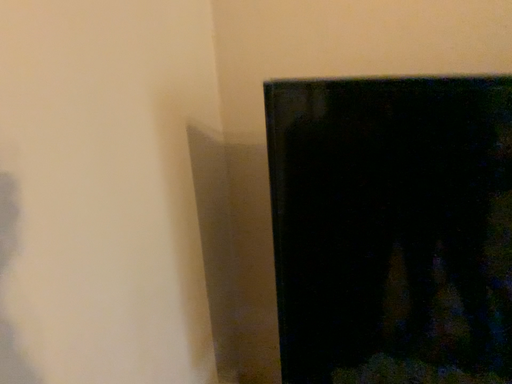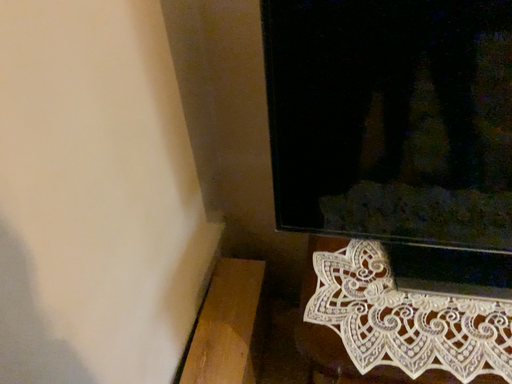
Question: Which way did the camera rotate in the video?

Choices:
 (A) rotated downward
 (B) rotated upward

Answer: (A)